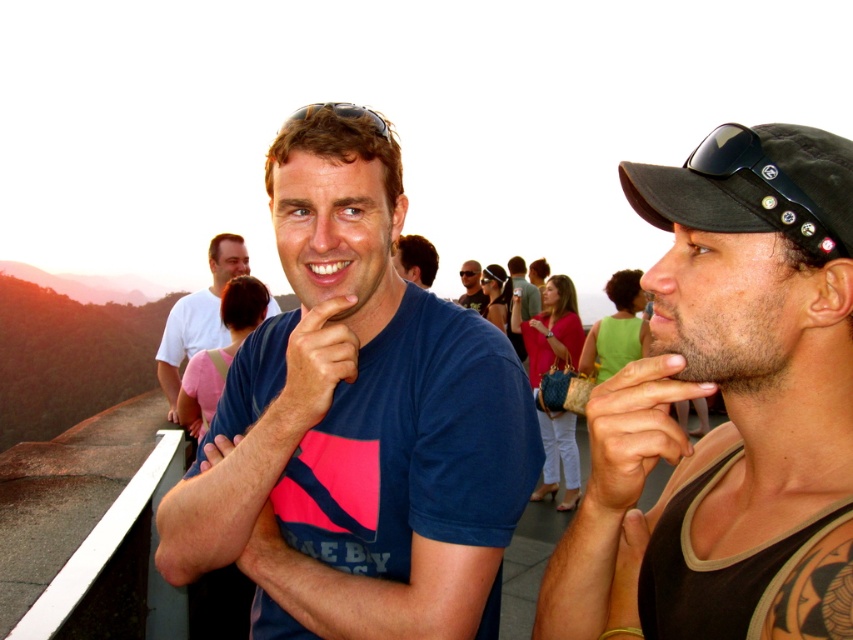
From the picture: Does green fabric shirt at center have a smaller size compared to smooth brown hair at center?

Incorrect, green fabric shirt at center is not smaller in size than smooth brown hair at center.

Can you confirm if green fabric shirt at center is positioned above smooth brown hair at center?

Incorrect, green fabric shirt at center is not positioned above smooth brown hair at center.

At what (x,y) coordinates should I click in order to perform the action: click on green fabric shirt at center. Please return your answer as a coordinate pair (x, y). Looking at the image, I should click on (519, 304).

Is black fabric cap at right taller than matte black sunglasses at center?

Yes.

Between point (749, 412) and point (476, 289), which one is positioned behind?

The point (476, 289) is behind.

Locate an element on the screen. The height and width of the screenshot is (640, 853). black fabric cap at right is located at coordinates (727, 406).

Between matte blue t-shirt at center and green fabric shirt at center, which one has less height?

matte blue t-shirt at center is shorter.

Can you confirm if matte blue t-shirt at center is wider than green fabric shirt at center?

Yes, matte blue t-shirt at center is wider than green fabric shirt at center.

Is point (175, 369) less distant than point (514, 332)?

That is True.

This screenshot has height=640, width=853. In order to click on matte blue t-shirt at center in this screenshot , I will do `click(199, 316)`.